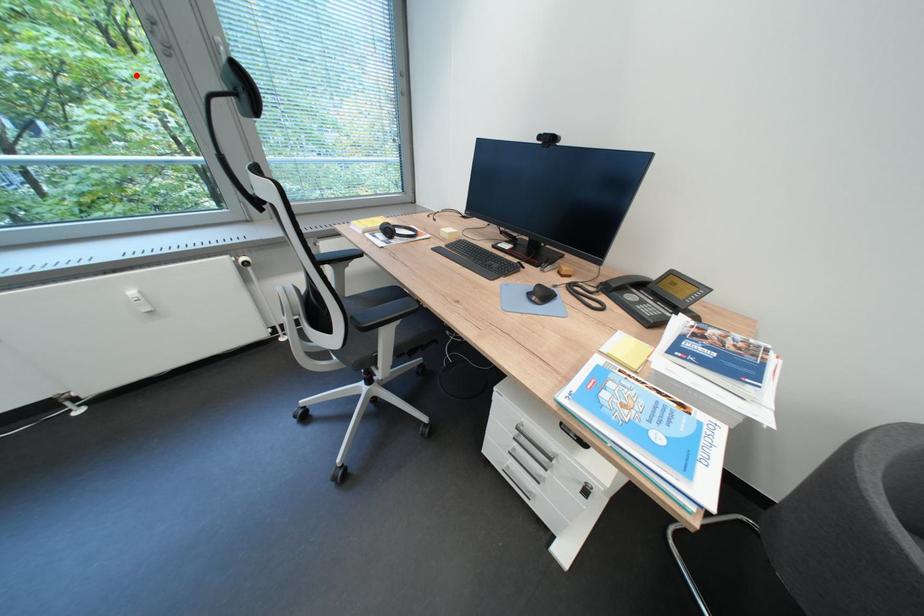
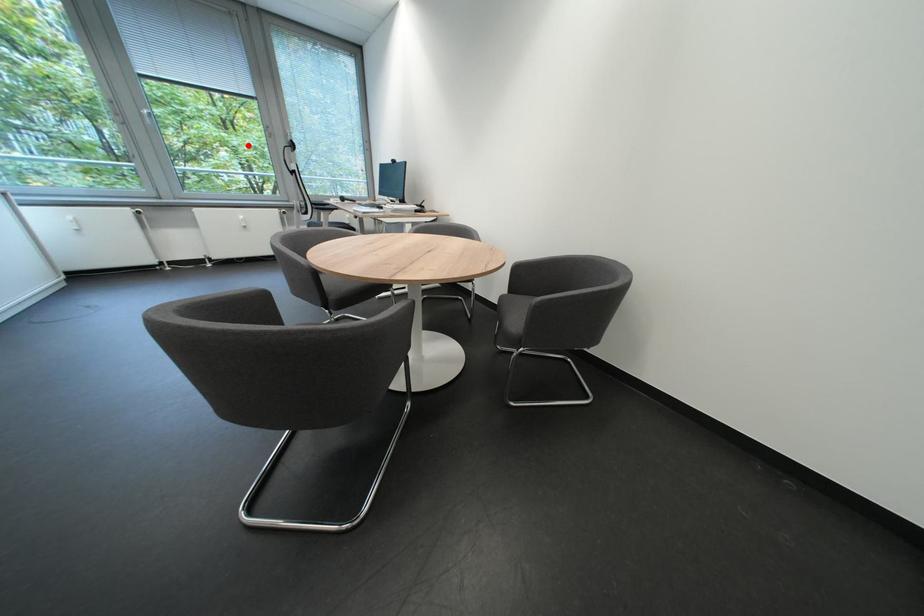
I am providing you with two images of the same scene from different viewpoints. A red point is marked on the first image and another point is marked on the second image. Is the red point in image1 aligned with the point shown in image2?

Yes